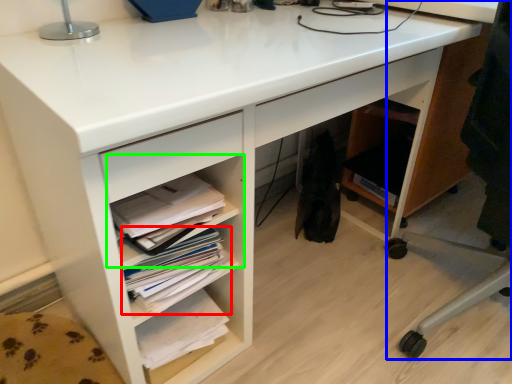
Question: Estimate the real-world distances between objects in this image. Which object is farther from book (highlighted by a red box), computer chair (highlighted by a blue box) or shelf (highlighted by a green box)?

Choices:
 (A) computer chair
 (B) shelf

Answer: (A)